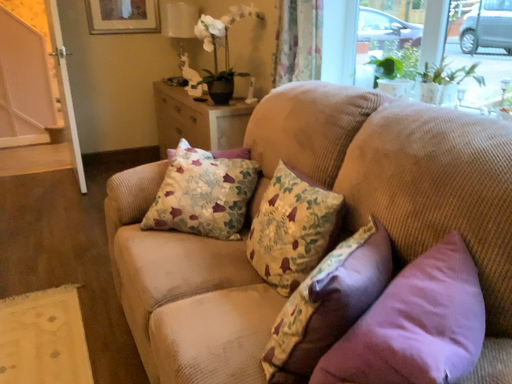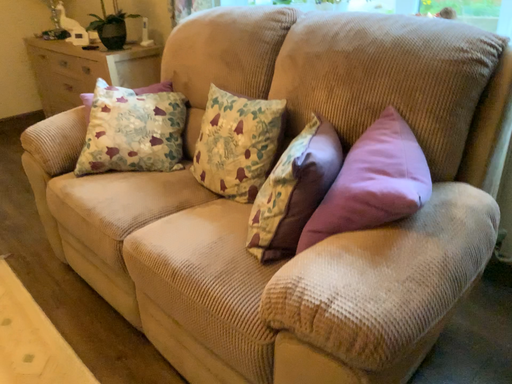
Question: Which way did the camera rotate in the video?

Choices:
 (A) rotated right
 (B) rotated left

Answer: (A)